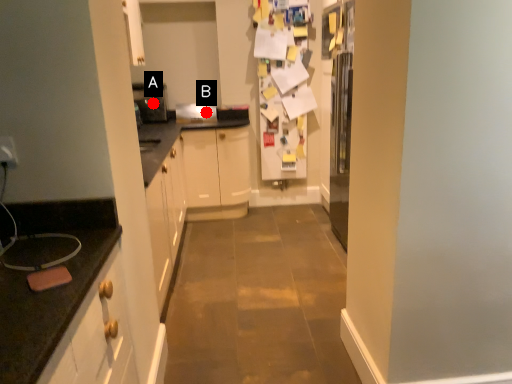
Question: Two points are circled on the image, labeled by A and B beside each circle. Which point appears farthest from the camera in this image?

Choices:
 (A) A is further
 (B) B is further

Answer: (B)